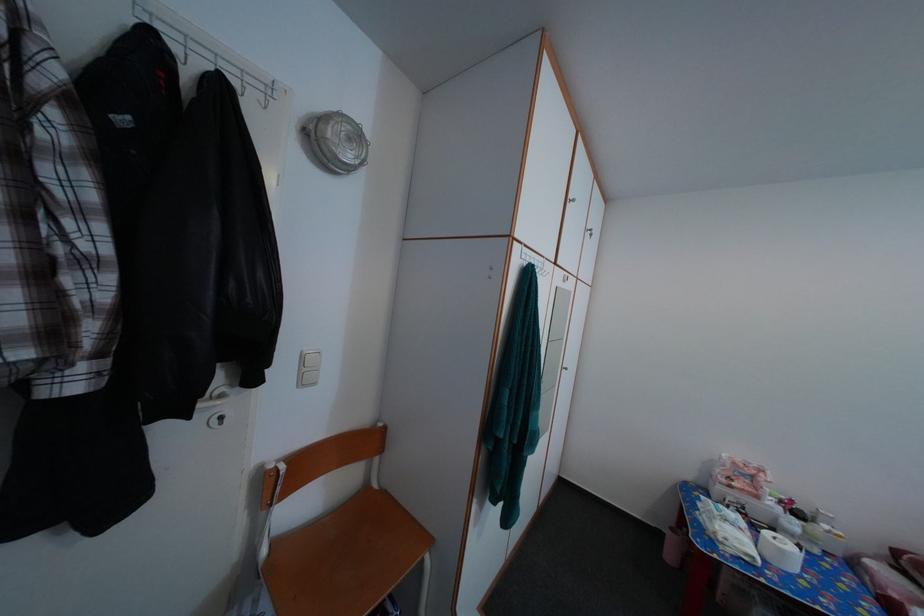
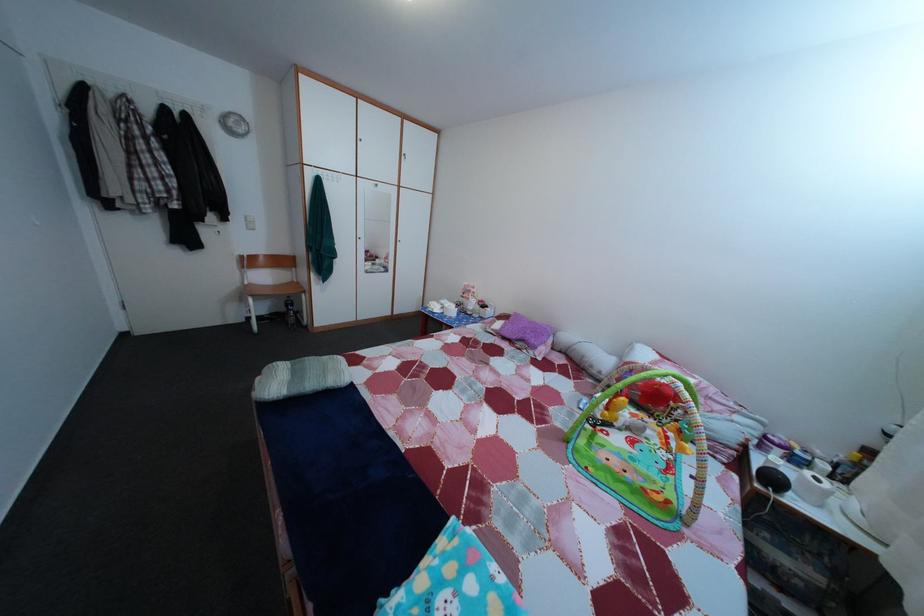
What movement of the cameraman would produce the second image?

The cameraman walked toward right, backward.